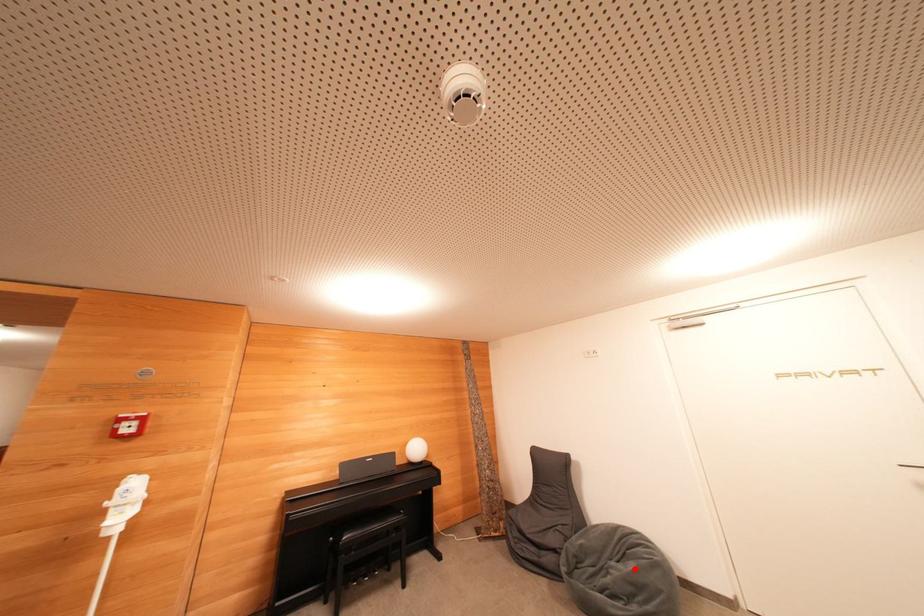
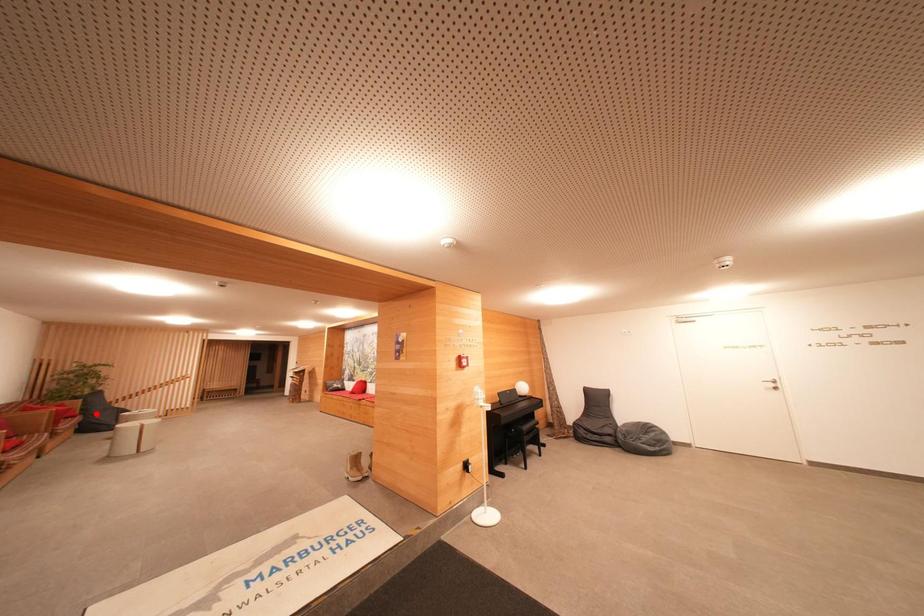
I am providing you with two images of the same scene from different viewpoints. A red point is marked on the first image and another point is marked on the second image. Does the point marked in image1 correspond to the same location as the one in image2?

No